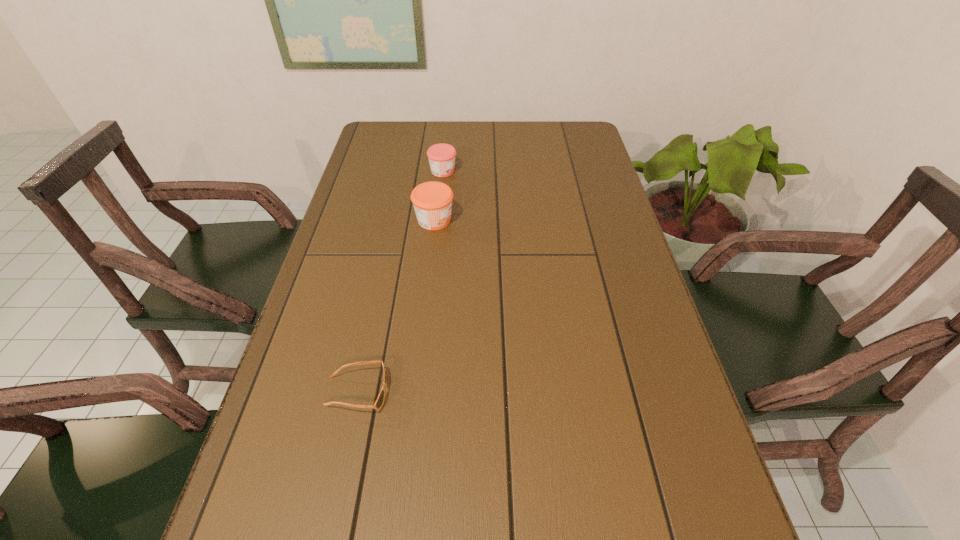
Locate an element on the screen. the second nearest object is located at coordinates (432, 201).

Image resolution: width=960 pixels, height=540 pixels. Find the location of `the taller jam`. the taller jam is located at coordinates (432, 201).

The width and height of the screenshot is (960, 540). Find the location of `the farther jam`. the farther jam is located at coordinates (441, 156).

At what (x,y) coordinates should I click in order to perform the action: click on the shorter jam. Please return your answer as a coordinate pair (x, y). Looking at the image, I should click on (441, 156).

The image size is (960, 540). What are the coordinates of `sunglasses` in the screenshot? It's located at (379, 402).

Where is `the shortest object`? the shortest object is located at coordinates (379, 402).

Image resolution: width=960 pixels, height=540 pixels. Find the location of `free space located 0.150m on the front label of the nearer jam`. free space located 0.150m on the front label of the nearer jam is located at coordinates (507, 220).

At what (x,y) coordinates should I click in order to perform the action: click on free space located 0.050m on the front label of the farther jam. Please return your answer as a coordinate pair (x, y). Looking at the image, I should click on (472, 171).

This screenshot has height=540, width=960. Identify the location of vacant space situated 0.380m on the front-facing side of the nearest object. (575, 392).

Locate an element on the screen. The height and width of the screenshot is (540, 960). object at the left edge is located at coordinates (379, 402).